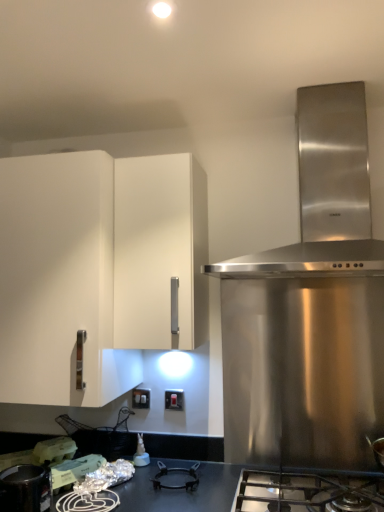
Question: From the image's perspective, is stainless steel gas stove at lower center located above or below white matte plastic container at lower left?

Choices:
 (A) below
 (B) above

Answer: (A)

Question: Looking at their shapes, would you say stainless steel gas stove at lower center is wider or thinner than white matte plastic container at lower left?

Choices:
 (A) thin
 (B) wide

Answer: (B)

Question: Which object is the closest to the white matte cabinet at left?

Choices:
 (A) shiny metallic pot at lower left
 (B) white plastic switch at lower center, the 1th electric outlet when ordered from right to left
 (C) white matte plastic container at lower left
 (D) stainless steel range hood at upper right
 (E) white plastic electric outlet at lower center, which ranks as the 1th electric outlet in left-to-right order

Answer: (A)

Question: Estimate the real-world distances between objects in this image. Which object is closer to the stainless steel range hood at upper right?

Choices:
 (A) white plastic electric outlet at lower center, the 2th electric outlet from the right
 (B) white matte plastic container at lower left
 (C) shiny metallic pot at lower left
 (D) white matte cabinet at left
 (E) stainless steel gas stove at lower center

Answer: (D)